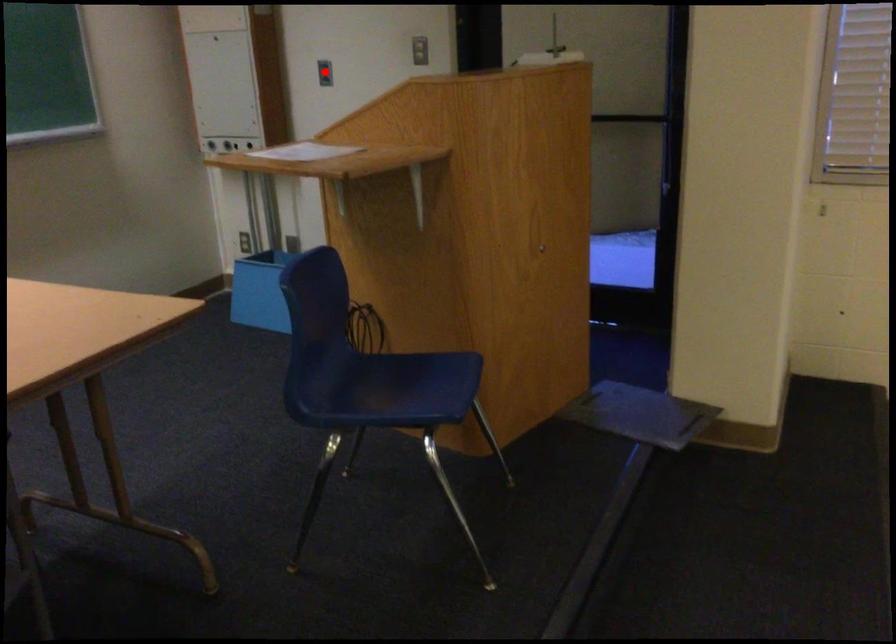
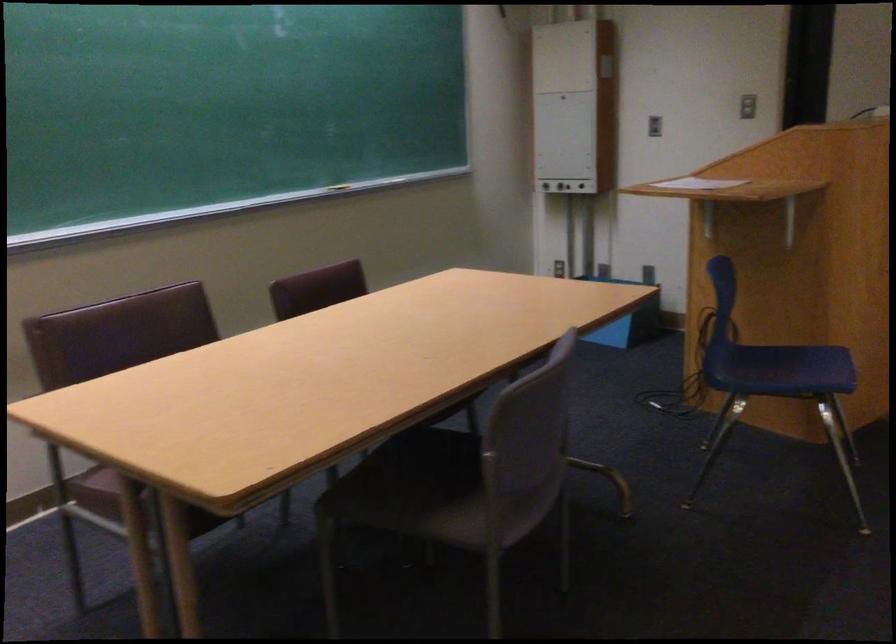
Question: I am providing you with two images of the same scene from different viewpoints. Given a red point in image1, look at the same physical point in image2. Is it:

Choices:
 (A) Closer to the viewpoint
 (B) Farther from the viewpoint

Answer: (B)